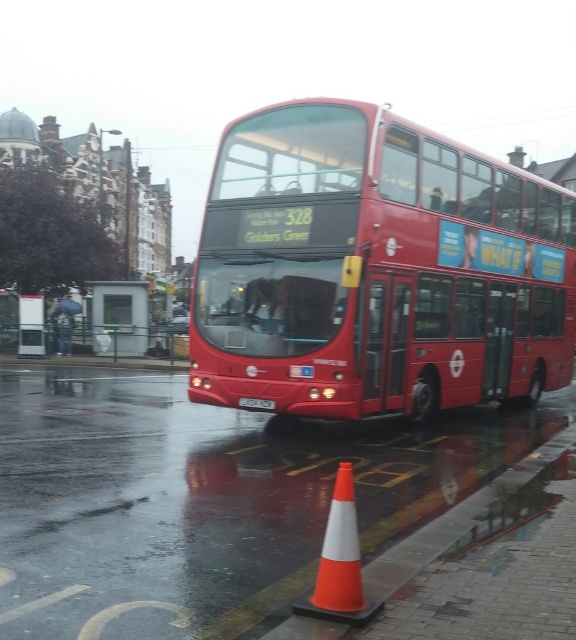
Question: Which of these objects is positioned closest to the shiny red bus at center?

Choices:
 (A) metallic silver bus stop at center
 (B) orange/white plastic traffic cone at lower center
 (C) white plastic license plate at center

Answer: (C)

Question: Can you confirm if shiny red bus at center is bigger than orange/white plastic traffic cone at lower center?

Choices:
 (A) no
 (B) yes

Answer: (B)

Question: Is metallic silver bus stop at center thinner than white plastic license plate at center?

Choices:
 (A) no
 (B) yes

Answer: (A)

Question: Among these objects, which one is farthest from the camera?

Choices:
 (A) white plastic license plate at center
 (B) orange/white plastic traffic cone at lower center
 (C) shiny red bus at center

Answer: (A)

Question: Among these points, which one is nearest to the camera?

Choices:
 (A) (373, 608)
 (B) (252, 404)

Answer: (A)

Question: Can you confirm if orange/white plastic traffic cone at lower center is positioned below metallic silver bus stop at center?

Choices:
 (A) no
 (B) yes

Answer: (B)